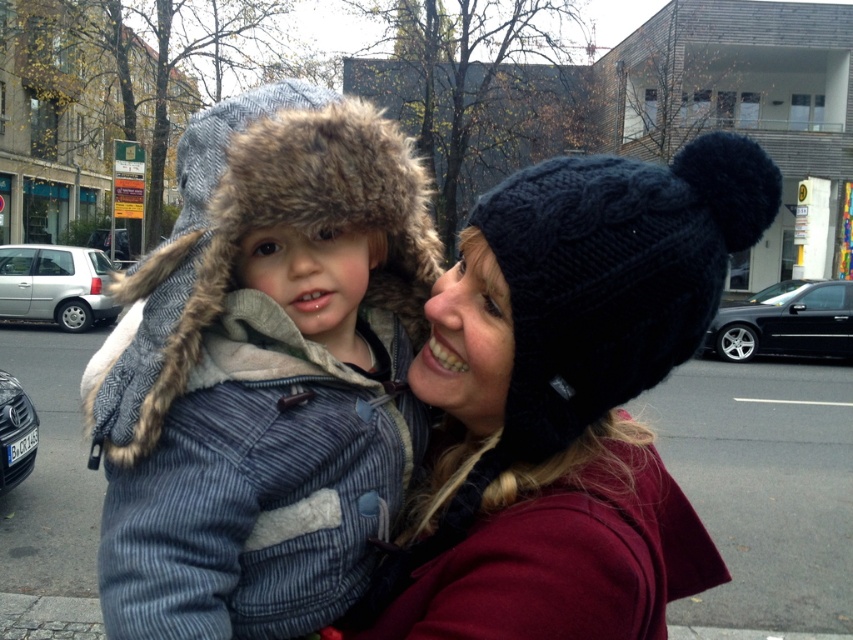
You are standing in the urban background and want to walk towards the closest point between point (198, 481) and point (619, 193). Which point should you head towards?

Point (619, 193) is closer to you than point (198, 481), so you should head towards point (619, 193).

You are a photographer trying to focus on the fuzzy fur hat at center in the image. The camera you are using has a focus point at coordinate point (x=265, y=385). Is this focus point correctly positioned to capture the fuzzy fur hat at center?

Yes, the focus point at coordinate point (x=265, y=385) is correctly positioned to capture the fuzzy fur hat at center because the description states that the point marks the fuzzy fur hat at center.

You are standing at the camera position and want to place a small gift exactly at the point marked as point (x=323, y=499). If you can reach 1.2 meters, will you be able to reach that point?

The point (x=323, y=499) is 1.24 meters from the camera. Since your reach is 1.2 meters, you cannot reach that point.